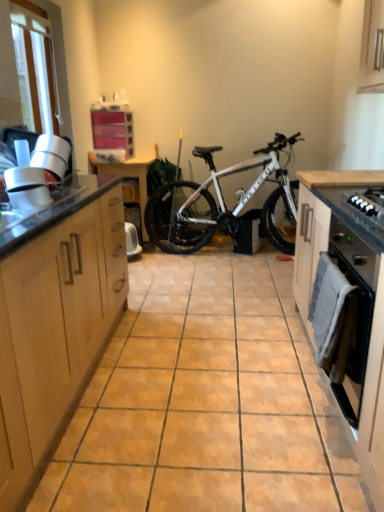
You are a GUI agent. You are given a task and a screenshot of the screen. Output one action in this format:
    pyautogui.click(x=<x>, y=<y>)
    Task: Click on the black matte gas stove at right
    The height and width of the screenshot is (512, 384).
    Given the screenshot: What is the action you would take?
    pyautogui.click(x=368, y=205)

Describe the element at coordinates (206, 402) in the screenshot. I see `orange matte tile at center` at that location.

What do you see at coordinates (372, 295) in the screenshot? I see `black matte oven door at right, marked as the 1th cabinetry in a right-to-left arrangement` at bounding box center [372, 295].

Find the location of a particular element. wooden at right is located at coordinates (340, 178).

The width and height of the screenshot is (384, 512). Identify the location of black matte gas stove at right. (368, 205).

From the picture: Is wooden at right to the left or to the right of black matte gas stove at right in the image?

wooden at right is to the right of black matte gas stove at right.

Does wooden at right touch black matte gas stove at right?

There is a gap between wooden at right and black matte gas stove at right.

Between wooden at right and black matte gas stove at right, which one has larger width?

wooden at right.

How much distance is there between wooden at right and black matte gas stove at right?

wooden at right and black matte gas stove at right are 36.55 centimeters apart.

Between transparent glass window at upper left and black matte oven door at right, which ranks as the second cabinetry in left-to-right order, which one has less height?

With less height is transparent glass window at upper left.

Is transparent glass window at upper left positioned with its back to black matte oven door at right, which ranks as the second cabinetry in left-to-right order?

transparent glass window at upper left is not turned away from black matte oven door at right, which ranks as the second cabinetry in left-to-right order.

Which is more to the left, transparent glass window at upper left or black matte oven door at right, marked as the 1th cabinetry in a right-to-left arrangement?

transparent glass window at upper left.

Could you tell me if light wood cabinet at left, positioned as the second cabinetry in right-to-left order, is facing black matte oven door at right, which ranks as the second cabinetry in left-to-right order?

Yes, light wood cabinet at left, positioned as the second cabinetry in right-to-left order, is facing black matte oven door at right, which ranks as the second cabinetry in left-to-right order.

Does point (31, 325) appear closer or farther from the camera than point (348, 377)?

Clearly, point (31, 325) is closer to the camera than point (348, 377).

Is light wood cabinet at left, positioned as the second cabinetry in right-to-left order, not near black matte oven door at right, which ranks as the second cabinetry in left-to-right order?

light wood cabinet at left, positioned as the second cabinetry in right-to-left order, is positioned a significant distance from black matte oven door at right, which ranks as the second cabinetry in left-to-right order.

From the image's perspective, between light wood cabinet at left, positioned as the second cabinetry in right-to-left order, and black matte oven door at right, which ranks as the second cabinetry in left-to-right order, who is located below?

black matte oven door at right, which ranks as the second cabinetry in left-to-right order, appears lower in the image.

Between wooden at right and black matte oven door at right, which ranks as the second cabinetry in left-to-right order, which one has larger size?

With larger size is black matte oven door at right, which ranks as the second cabinetry in left-to-right order.

Could you tell me if wooden at right is facing black matte oven door at right, marked as the 1th cabinetry in a right-to-left arrangement?

No, wooden at right is not oriented towards black matte oven door at right, marked as the 1th cabinetry in a right-to-left arrangement.

What's the angular difference between wooden at right and black matte oven door at right, which ranks as the second cabinetry in left-to-right order,'s facing directions?

0.000735 degrees separate the facing orientations of wooden at right and black matte oven door at right, which ranks as the second cabinetry in left-to-right order.

From the image's perspective, between wooden at right and black matte oven door at right, marked as the 1th cabinetry in a right-to-left arrangement, who is located below?

black matte oven door at right, marked as the 1th cabinetry in a right-to-left arrangement.

Does wooden table at center have a lesser width compared to transparent glass window at upper left?

No.

Considering the relative positions of wooden table at center and transparent glass window at upper left in the image provided, is wooden table at center in front of transparent glass window at upper left?

No, it is not.

From a real-world perspective, which is physically below, wooden table at center or transparent glass window at upper left?

wooden table at center, from a real-world perspective.

In terms of size, does black matte gas stove at right appear bigger or smaller than light wood cabinet at left, positioned as the second cabinetry in right-to-left order?

In the image, black matte gas stove at right appears to be smaller than light wood cabinet at left, positioned as the second cabinetry in right-to-left order.

Which object is wider, black matte gas stove at right or light wood cabinet at left, the 1th cabinetry positioned from the left?

light wood cabinet at left, the 1th cabinetry positioned from the left, is wider.

Which is behind, point (363, 216) or point (99, 214)?

The point (99, 214) is farther from the camera.

What's the angular difference between black matte gas stove at right and light wood cabinet at left, positioned as the second cabinetry in right-to-left order,'s facing directions?

They differ by 180 degrees in their facing directions.

Which is in front, point (171, 215) or point (16, 207)?

Positioned in front is point (16, 207).

Considering the relative sizes of white matte bicycle at center and white glossy vent at left in the image provided, is white matte bicycle at center shorter than white glossy vent at left?

No.

Is white matte bicycle at center to the right of white glossy vent at left from the viewer's perspective?

Correct, you'll find white matte bicycle at center to the right of white glossy vent at left.

Is white matte bicycle at center in contact with white glossy vent at left?

No, white matte bicycle at center is not next to white glossy vent at left.

Where is `counter top lying above the black matte gas stove at right (from the image's perspective)`? counter top lying above the black matte gas stove at right (from the image's perspective) is located at coordinates (340, 178).

From a real-world perspective, starting from the transparent glass window at upper left, which cabinetry is the 2nd one below it? Please provide its 2D coordinates.

[(372, 295)]

Which object lies nearer to the anchor point black matte oven at right, black matte gas stove at right or wooden table at center?

Based on the image, black matte gas stove at right appears to be nearer to black matte oven at right.

Considering their positions, is orange matte tile at center positioned further to light wood cabinet at left, positioned as the second cabinetry in right-to-left order, than wooden at right?

wooden at right lies further to light wood cabinet at left, positioned as the second cabinetry in right-to-left order, than the other object.

Based on their spatial positions, is wooden table at center or black matte oven door at right, which ranks as the second cabinetry in left-to-right order, further from light wood cabinet at left, positioned as the second cabinetry in right-to-left order?

wooden table at center lies further to light wood cabinet at left, positioned as the second cabinetry in right-to-left order, than the other object.

Looking at the image, which one is located closer to white matte bicycle at center, light wood cabinet at left, positioned as the second cabinetry in right-to-left order, or wooden table at center?

wooden table at center is closer to white matte bicycle at center.

Estimate the real-world distances between objects in this image. Which object is closer to black matte gas stove at right, wooden table at center or white matte bicycle at center?

white matte bicycle at center is positioned closer to the anchor black matte gas stove at right.

Considering their positions, is transparent glass window at upper left positioned further to black matte gas stove at right than orange matte tile at center?

transparent glass window at upper left is positioned further to the anchor black matte gas stove at right.

From the image, which object appears to be farther from wooden at right, black matte oven at right or wooden table at center?

wooden table at center is positioned further to the anchor wooden at right.

From the image, which object appears to be farther from black matte gas stove at right, orange matte tile at center or white glossy vent at left?

Among the two, white glossy vent at left is located further to black matte gas stove at right.

The width and height of the screenshot is (384, 512). What are the coordinates of `window screen between black matte oven door at right, which ranks as the second cabinetry in left-to-right order, and white matte bicycle at center from front to back` in the screenshot? It's located at (37, 65).

Where is `oven between light wood cabinet at left, the 1th cabinetry positioned from the left, and black matte oven door at right, which ranks as the second cabinetry in left-to-right order, in the horizontal direction`? oven between light wood cabinet at left, the 1th cabinetry positioned from the left, and black matte oven door at right, which ranks as the second cabinetry in left-to-right order, in the horizontal direction is located at coordinates (341, 326).

Where is `appliance located between black matte oven at right and wooden table at center in the depth direction`? appliance located between black matte oven at right and wooden table at center in the depth direction is located at coordinates (27, 189).

This screenshot has width=384, height=512. In order to click on appliance situated between transparent glass window at upper left and wooden at right from left to right in this screenshot , I will do `click(27, 189)`.